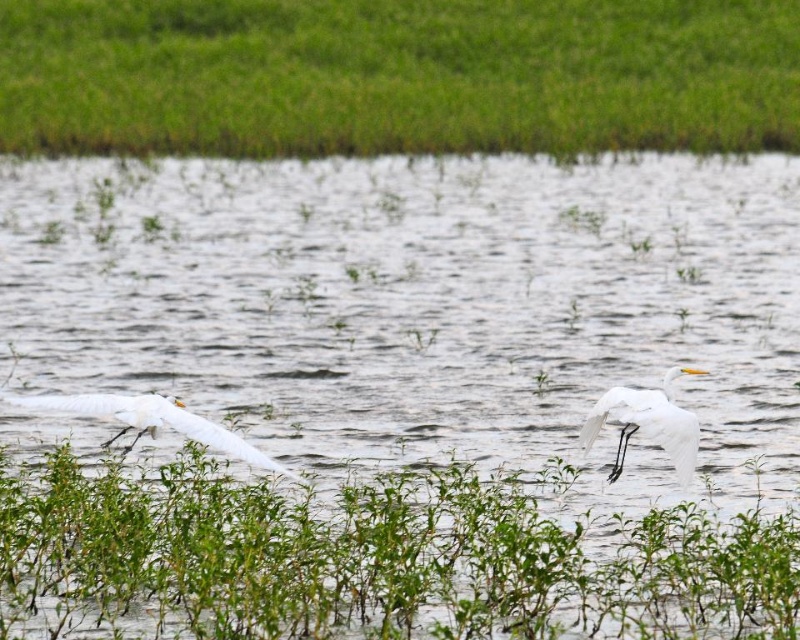
Can you confirm if green leafy plants at lower center is positioned below white feathered bird at left?

Yes, green leafy plants at lower center is below white feathered bird at left.

Is green leafy plants at lower center further to camera compared to white feathered bird at left?

No, it is in front of white feathered bird at left.

The width and height of the screenshot is (800, 640). In order to click on green leafy plants at lower center in this screenshot , I will do `click(370, 560)`.

Where is `green leafy plants at lower center`? This screenshot has height=640, width=800. green leafy plants at lower center is located at coordinates (370, 560).

Based on the photo, which is more to the left, green grass at upper center or white matte bird at center?

Positioned to the left is green grass at upper center.

Measure the distance between point (14, 109) and camera.

Point (14, 109) is 19.64 meters away from camera.

Is point (29, 29) in front of point (614, 474)?

That is False.

In order to click on green grass at upper center in this screenshot , I will do `click(397, 76)`.

The width and height of the screenshot is (800, 640). Describe the element at coordinates (397, 76) in the screenshot. I see `green grass at upper center` at that location.

Does green grass at upper center have a lesser height compared to green leafy plants at lower center?

No, green grass at upper center is not shorter than green leafy plants at lower center.

Is point (714, 19) closer to viewer compared to point (4, 582)?

No.

The width and height of the screenshot is (800, 640). Find the location of `green grass at upper center`. green grass at upper center is located at coordinates (397, 76).